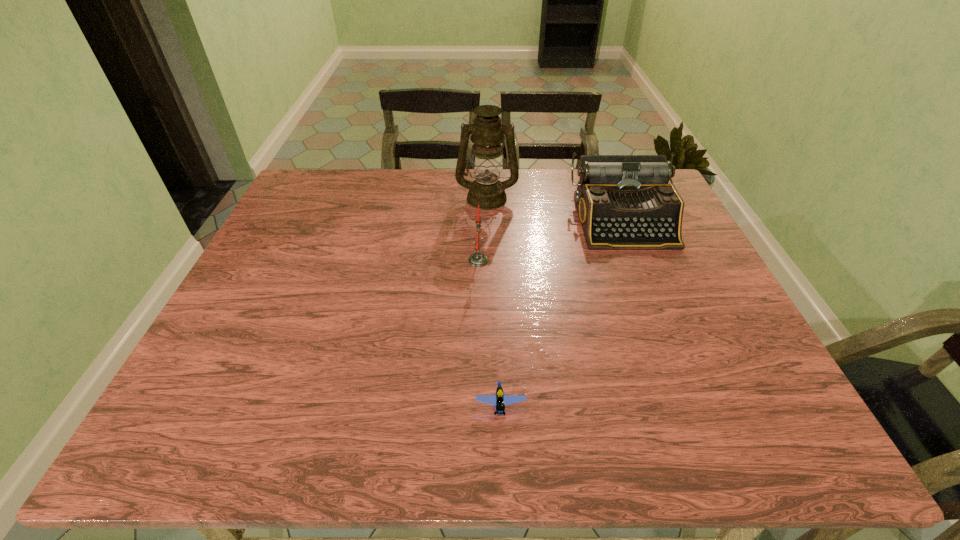
Find the location of a particular element. the tallest object is located at coordinates (487, 131).

Where is `the rightmost object`? The image size is (960, 540). the rightmost object is located at coordinates (624, 202).

I want to click on candle, so click(x=477, y=259).

Where is `the nearest object`? the nearest object is located at coordinates (499, 400).

This screenshot has width=960, height=540. What are the coordinates of `the shortest object` in the screenshot? It's located at (499, 400).

At what (x,y) coordinates should I click in order to perform the action: click on vacant point located on the right of the tallest object. Please return your answer as a coordinate pair (x, y). The image size is (960, 540). Looking at the image, I should click on tap(578, 198).

Where is `vacant space located 0.380m on the keyboard of the typewriter`? The image size is (960, 540). vacant space located 0.380m on the keyboard of the typewriter is located at coordinates (684, 369).

At what (x,y) coordinates should I click in order to perform the action: click on vacant space situated 0.070m on the front-facing side of the candle. Please return your answer as a coordinate pair (x, y). Looking at the image, I should click on (515, 260).

Locate an element on the screen. This screenshot has height=540, width=960. oil lamp that is positioned at the far edge is located at coordinates (487, 131).

Locate an element on the screen. typewriter located in the far edge section of the desktop is located at coordinates (624, 202).